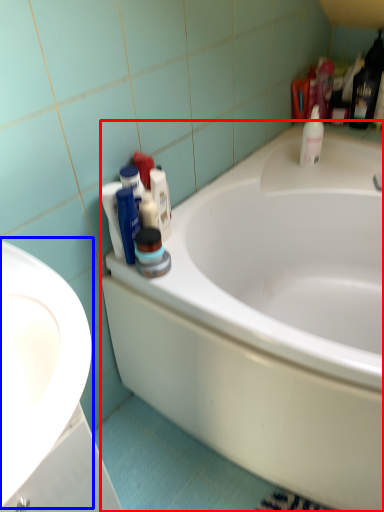
Question: Which of the following is the farthest to the observer, bathtub (highlighted by a red box) or sink (highlighted by a blue box)?

Choices:
 (A) bathtub
 (B) sink

Answer: (A)